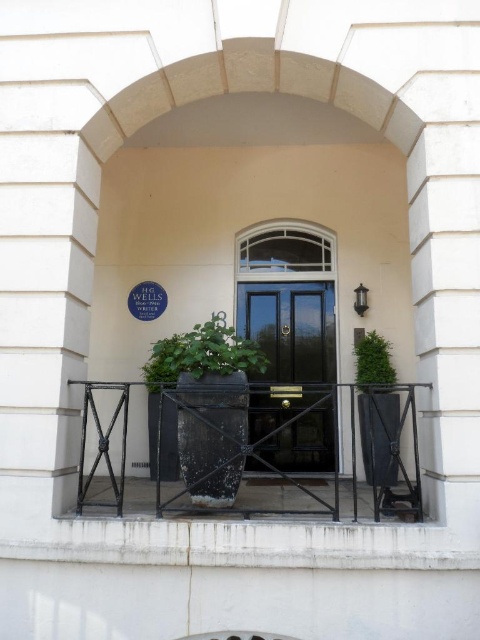
You are a delivery person trying to deliver a package to the entrance of the building. The package is too large to carry while going through the black wrought iron rail at center. Can you walk around the rail and place the package near the green leafy plant at center?

The black wrought iron rail at center is much taller than the green leafy plant at center, so you can walk around the rail and place the package near the green leafy plant at center since the rail is taller and may block your path, but the plant is shorter and allows easier access.

Consider the image. You are a painter standing at the entrance of the building and want to paint the black wrought iron rail at center and the black polished wood door at center. Which object do you need to look up more to paint?

The black polished wood door at center is taller than the black wrought iron rail at center, so you need to look up more to paint the black polished wood door at center.